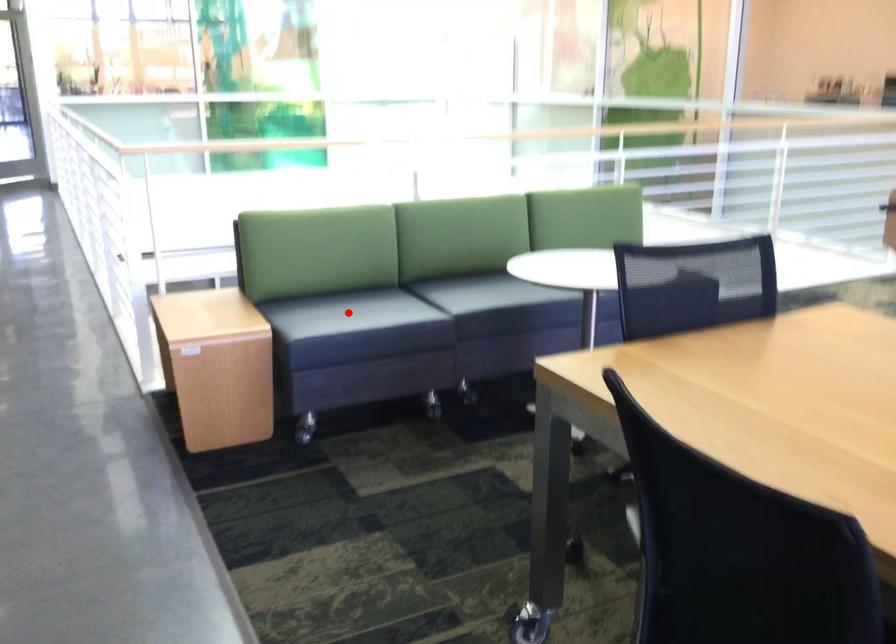
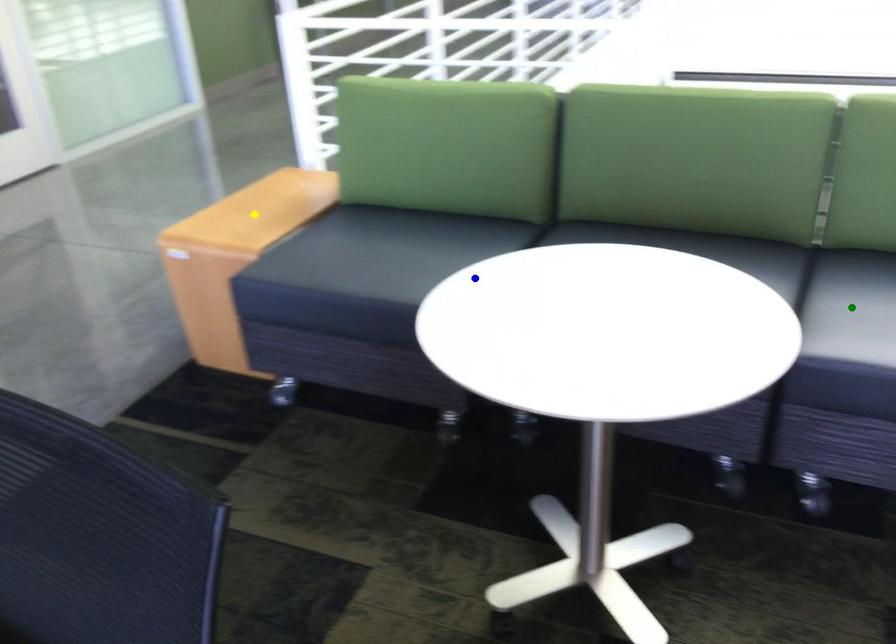
Question: I am providing you with two images of the same scene from different viewpoints. A red point is marked on the first image. You are given multiple points on the second image. Which point in image 2 represents the same 3d spot as the red point in image 1?

Choices:
 (A) green point
 (B) blue point
 (C) yellow point

Answer: (B)